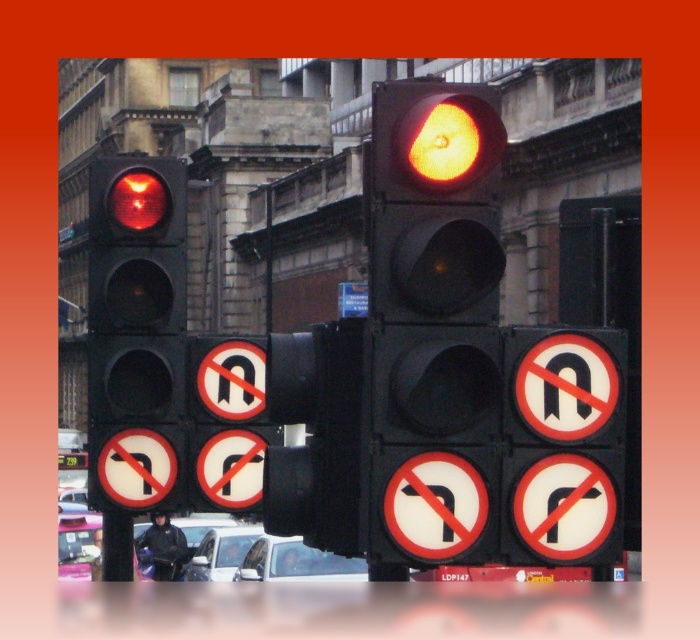
Question: Which point appears farthest from the camera in this image?

Choices:
 (A) (172, 308)
 (B) (489, 422)
 (C) (204, 378)

Answer: (C)

Question: Does matte black traffic light at center appear on the left side of matte black traffic light at left?

Choices:
 (A) yes
 (B) no

Answer: (B)

Question: Which point appears closest to the camera in this image?

Choices:
 (A) (218, 364)
 (B) (113, 449)
 (C) (402, 92)

Answer: (C)

Question: Which point is farther to the camera?

Choices:
 (A) matte black traffic light at center
 (B) matte black traffic light at left
 (C) white circular sign at center

Answer: (C)

Question: Can you confirm if matte black traffic light at center is thinner than matte black traffic light at left?

Choices:
 (A) yes
 (B) no

Answer: (A)

Question: Does matte black traffic light at left appear over white circular sign at center?

Choices:
 (A) no
 (B) yes

Answer: (B)